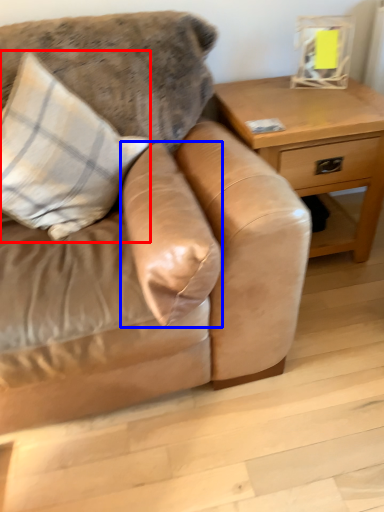
Question: Among these objects, which one is nearest to the camera, pillow (highlighted by a red box) or pillow (highlighted by a blue box)?

Choices:
 (A) pillow
 (B) pillow

Answer: (B)